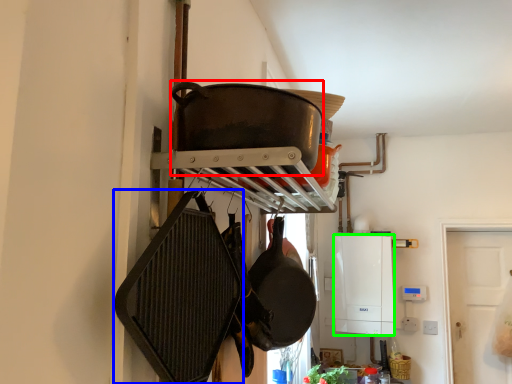
Question: Based on their relative distances, which object is nearer to wok (highlighted by a red box)? Choose from frying pan (highlighted by a blue box) and appliance (highlighted by a green box).

Choices:
 (A) frying pan
 (B) appliance

Answer: (A)